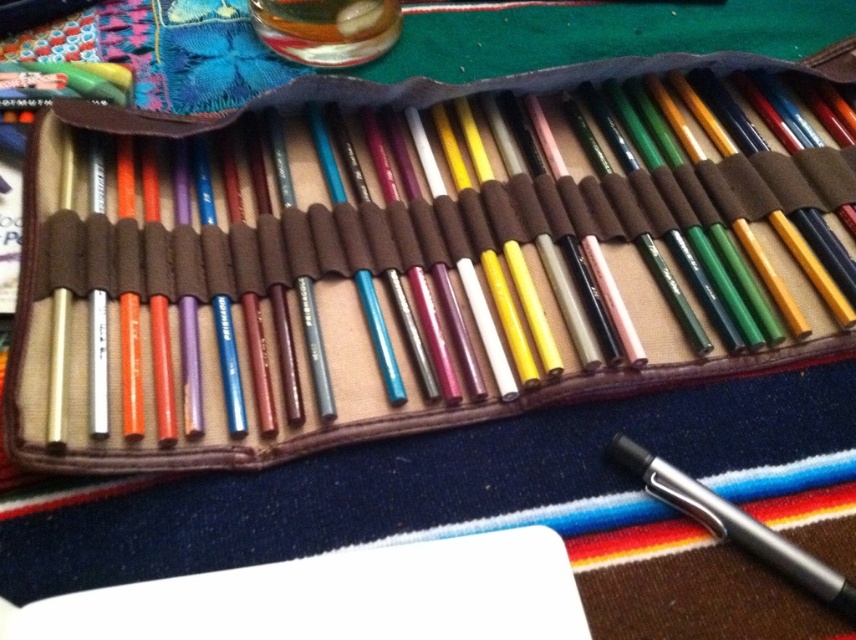
You are an artist who needs to write a note. You see the white paper at lower center and the metallic silver pen at lower right. Which object is closer to you, the viewer?

The white paper at lower center is located below the metallic silver pen at lower right, so the metallic silver pen at lower right is closer to you.

You are an artist who wants to place a new pencil case on a white paper at lower center. Based on the scene description, where should you position the pencil case to ensure it aligns with the existing arrangement?

The white paper at lower center is located at point [337,596]. Therefore, the pencil case should be positioned at that coordinate to align with the existing arrangement.

You are looking at the pencil case with two points marked inside it. The first point is at position [486,547] and the second point is at [851,584]. Which point is closer to you?

Point [486,547] is closer to you because it is in front of point [851,584].